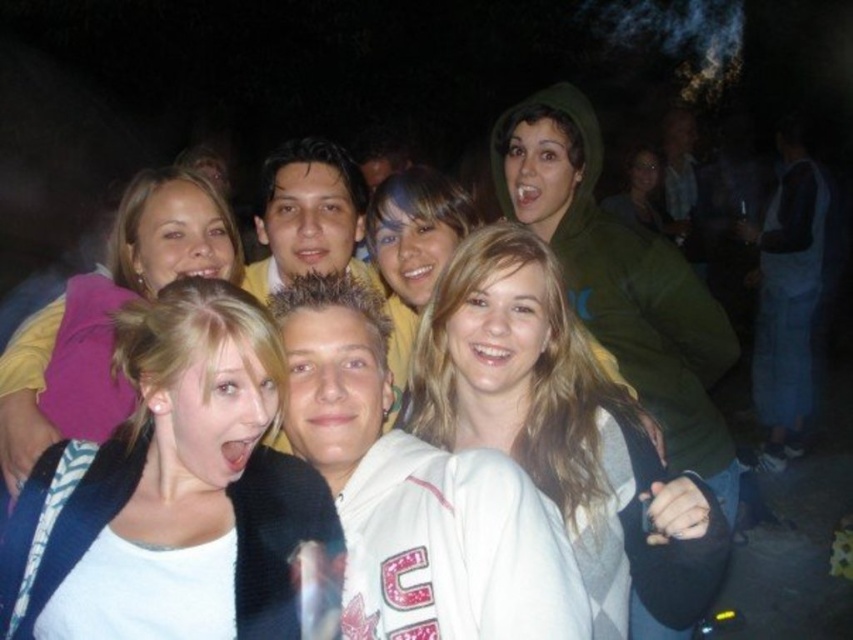
You are a photographer at the event and want to ensure that both the smooth green hoodie at upper center and the matte green hoodie at upper center are clearly visible in your photo. Given their thickness, which hoodie might you need to adjust the focus on to ensure it stands out more?

The matte green hoodie at upper center is thicker than the smooth green hoodie at upper center. To ensure it stands out more, you might adjust the focus on the matte green hoodie at upper center since its thickness could make it more prominent in the photo.